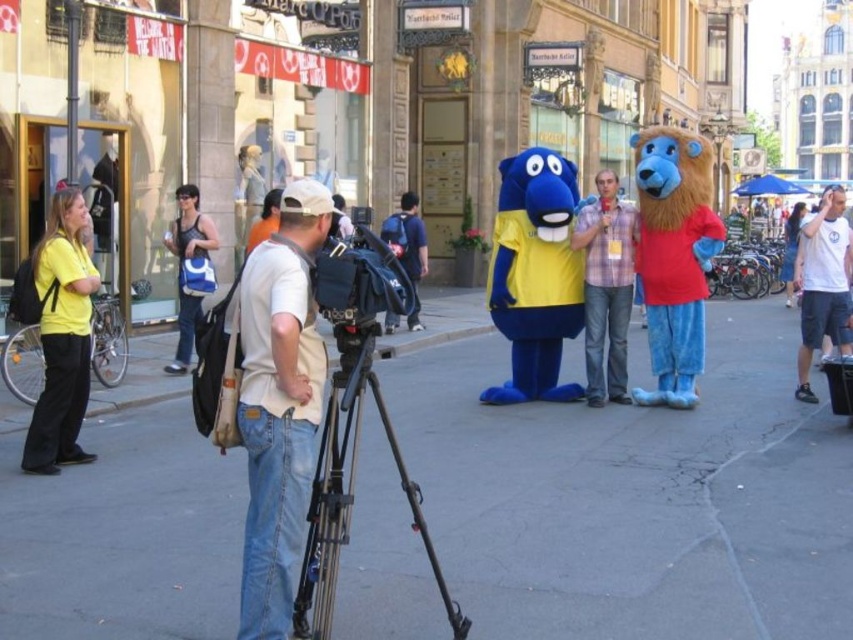
Where is `gray concrete pavement at center`? gray concrete pavement at center is located at coordinates (636, 497).

Locate an element on the screen. gray concrete pavement at center is located at coordinates (636, 497).

Who is shorter, gray concrete pavement at center or white cotton t-shirt at right?

With less height is gray concrete pavement at center.

Can you confirm if gray concrete pavement at center is wider than white cotton t-shirt at right?

Yes.

Does point (770, 445) lie behind point (840, 186)?

No, (770, 445) is in front of (840, 186).

Where is `gray concrete pavement at center`? This screenshot has height=640, width=853. gray concrete pavement at center is located at coordinates (636, 497).

Does point (325, 508) come closer to viewer compared to point (421, 225)?

That is True.

This screenshot has height=640, width=853. Describe the element at coordinates (350, 488) in the screenshot. I see `black matte tripod at center` at that location.

Where is `black matte tripod at center`? black matte tripod at center is located at coordinates (350, 488).